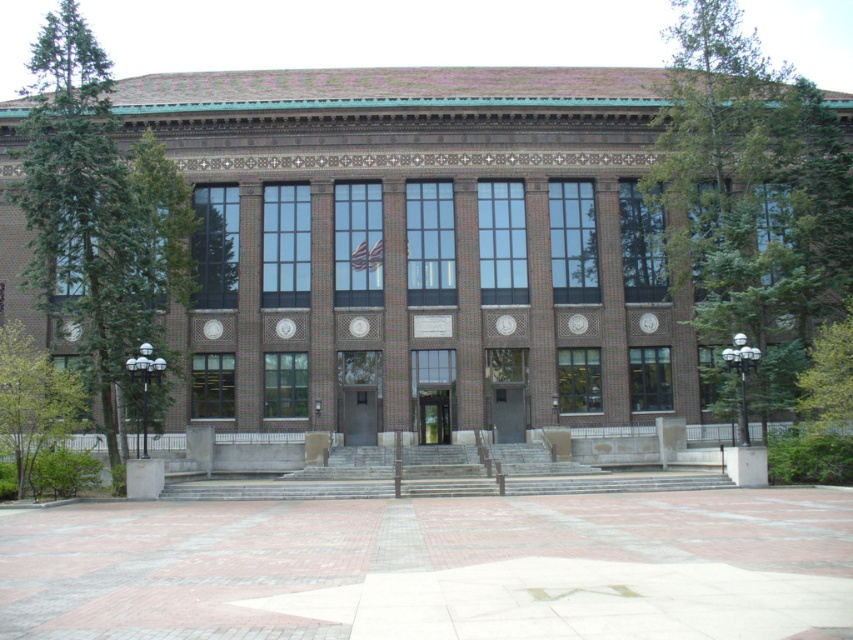
Question: Is green leafy tree at upper right above green coniferous tree at left?

Choices:
 (A) no
 (B) yes

Answer: (B)

Question: Can you confirm if green leafy tree at upper right is wider than green coniferous tree at left?

Choices:
 (A) no
 (B) yes

Answer: (A)

Question: Which of the following is the closest to the observer?

Choices:
 (A) green leafy tree at upper right
 (B) green coniferous tree at left
 (C) green leafy tree at lower left

Answer: (C)

Question: Which is farther from the green leafy tree at lower left?

Choices:
 (A) green leafy tree at upper right
 (B) green coniferous tree at left

Answer: (A)

Question: Is green leafy tree at upper right below green leafy tree at lower left?

Choices:
 (A) yes
 (B) no

Answer: (B)

Question: Estimate the real-world distances between objects in this image. Which object is farther from the green leafy tree at lower left?

Choices:
 (A) green leafy tree at upper right
 (B) green coniferous tree at left

Answer: (A)